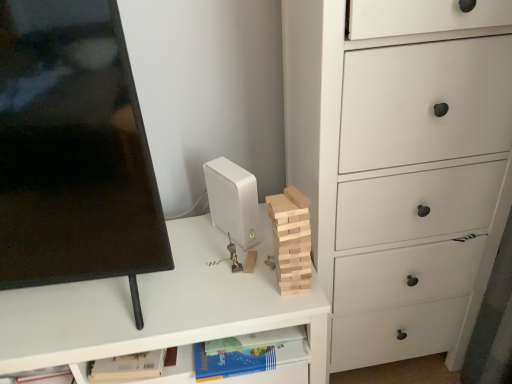
The height and width of the screenshot is (384, 512). Identify the location of free space above white matte desk at center (from a real-world perspective). (154, 289).